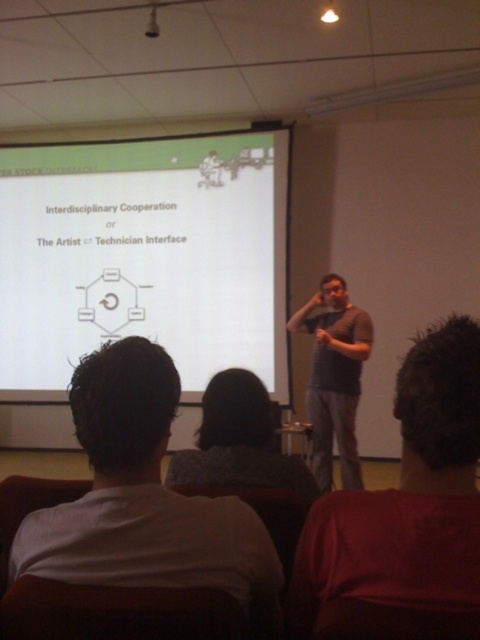
You are standing in the lecture hall and want to move to the point marked as point [216,422]. The room has a 1.6 meter wide door on your left. Can you walk through the door to reach that point?

The distance between you and point [216,422] is 1.55 meters. Since the door is 1.6 meters wide, which is wider than the distance, you can walk through the door to reach the point.